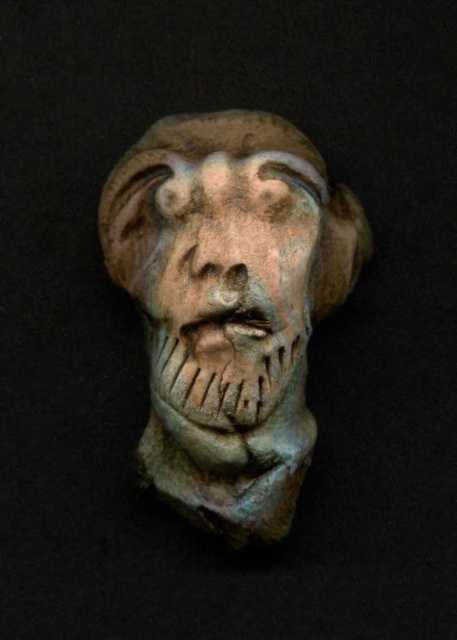
You are an art restorer examining a sculpture. You notice the matte clay mask at center and the matte clay nose at center. Which object is located higher on the sculpture?

The matte clay nose at center is higher because the matte clay mask at center is positioned under it.

You are an art restorer examining the sculpture. You notice that the matte clay nose at center is slightly chipped. To repair it, you need to know its position relative to the matte clay mask at center. Which object is positioned to the right of the other?

The matte clay mask at center is to the right of the matte clay nose at center, so the mask is positioned to the right of the nose.

You are an artisan who needs to attach a decorative gem to the matte clay mask at center and the matte clay nose at center. The gems you have are 1 inch in diameter. Can you fit two gems, one on each object, without overlapping?

The matte clay mask at center and matte clay nose at center are 4.69 inches apart from each other. Since the gems are only 1 inch in diameter each, placing them on each object would leave sufficient space between them, so yes, they can be placed without overlapping.